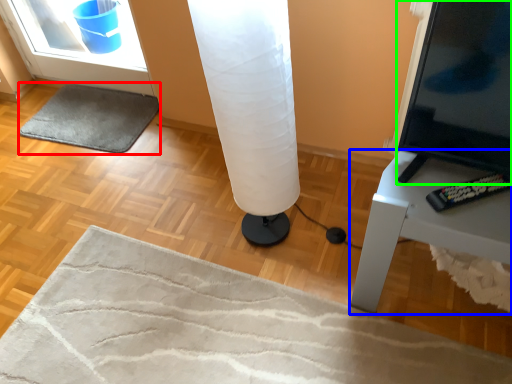
Question: Which object is the farthest from yoga mat (highlighted by a red box)? Choose among these: furniture (highlighted by a blue box) or screen (highlighted by a green box).

Choices:
 (A) furniture
 (B) screen

Answer: (B)